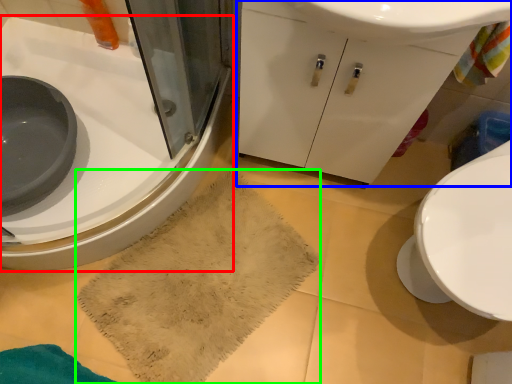
Question: Which object is the closest to the sink (highlighted by a red box)? Choose among these: bathroom cabinet (highlighted by a blue box) or bath towel (highlighted by a green box).

Choices:
 (A) bathroom cabinet
 (B) bath towel

Answer: (B)